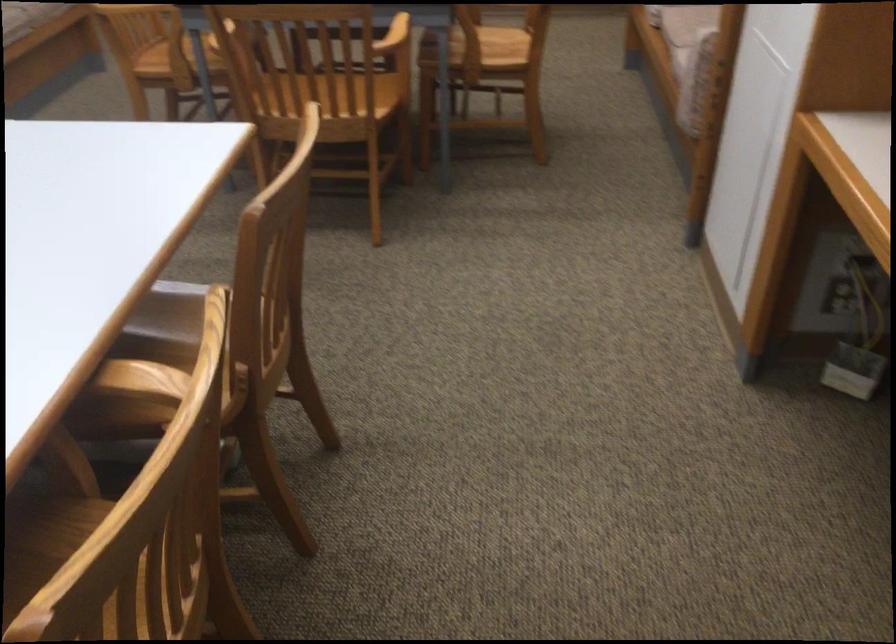
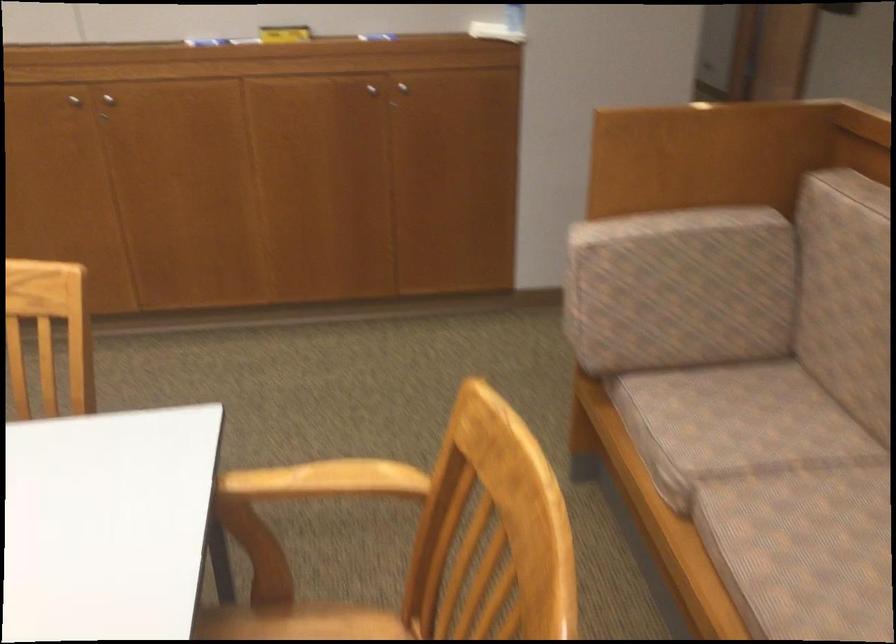
Question: What movement of the cameraman would produce the second image?

Choices:
 (A) Left
 (B) Right
 (C) Forward
 (D) Backward

Answer: (C)